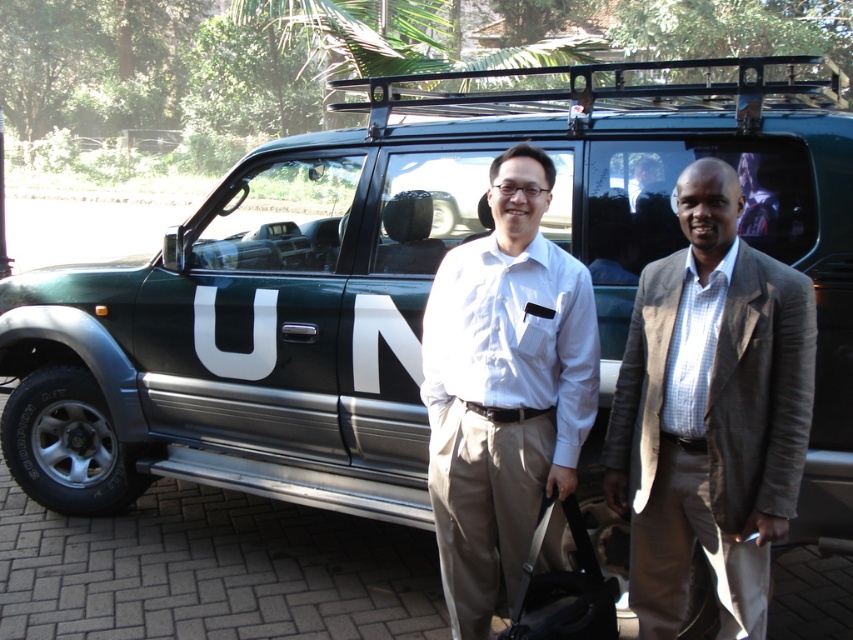
In the scene shown: Who is positioned more to the left, green matte un vehicle at center or black leather suitcase at center?

green matte un vehicle at center

Does green matte un vehicle at center lie in front of black leather suitcase at center?

No, it is not.

Between point (556, 268) and point (548, 616), which one is positioned in front?

Positioned in front is point (548, 616).

The image size is (853, 640). Identify the location of green matte un vehicle at center. point(503,387).

Is gray wool blazer at right to the left of green matte un vehicle at center from the viewer's perspective?

Incorrect, gray wool blazer at right is not on the left side of green matte un vehicle at center.

Between point (787, 298) and point (560, 410), which one is positioned in front?

Point (787, 298) is in front.

This screenshot has width=853, height=640. Identify the location of gray wool blazer at right. (711, 412).

Which is more to the left, gray wool blazer at right or black leather suitcase at center?

From the viewer's perspective, black leather suitcase at center appears more on the left side.

Where is `gray wool blazer at right`? The width and height of the screenshot is (853, 640). gray wool blazer at right is located at coordinates 711,412.

What are the coordinates of `gray wool blazer at right` in the screenshot? It's located at (711, 412).